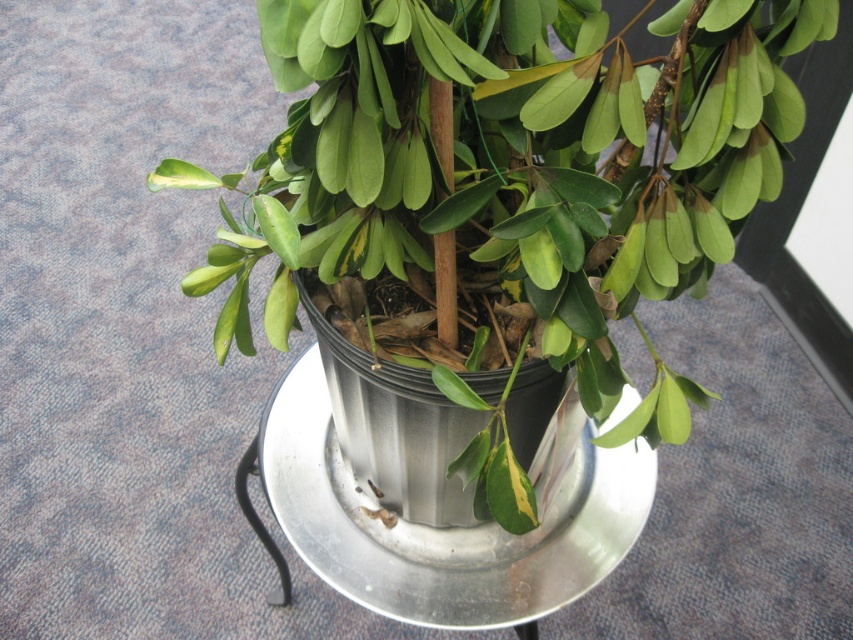
Question: Is metallic silver pot at center above green matte leaf at center?

Choices:
 (A) no
 (B) yes

Answer: (A)

Question: Which point is closer to the camera?

Choices:
 (A) (281, 134)
 (B) (358, 394)
 (C) (393, 269)

Answer: (C)

Question: Which of the following is the closest to the observer?

Choices:
 (A) (392, 476)
 (B) (277, 144)

Answer: (B)

Question: Which point is farther to the camera?

Choices:
 (A) green matte leaf at center
 (B) metallic silver pot at center

Answer: (B)

Question: Does metallic silver pot at center lie behind green matte leaf at center?

Choices:
 (A) yes
 (B) no

Answer: (A)

Question: Can you confirm if green matte plant at center is bigger than green matte leaf at center?

Choices:
 (A) yes
 (B) no

Answer: (A)